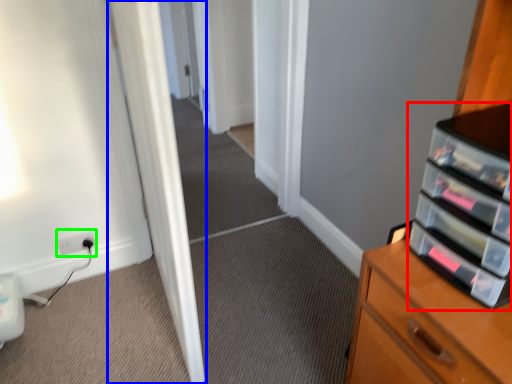
Question: Which object is the farthest from shelf (highlighted by a red box)? Choose among these: door (highlighted by a blue box) or electric outlet (highlighted by a green box).

Choices:
 (A) door
 (B) electric outlet

Answer: (B)